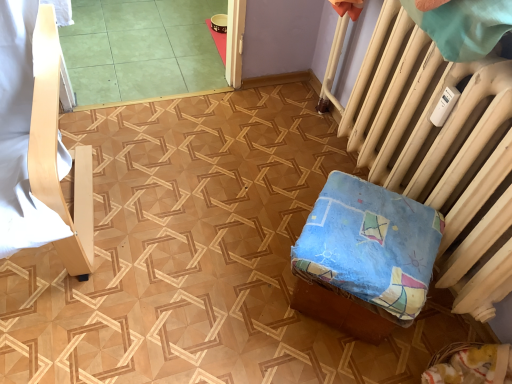
At what (x,y) coordinates should I click in order to perform the action: click on free area in between light wood chair at left, the first furniture viewed from the left, and blue fabric cushion at lower right, marked as the second furniture in a left-to-right arrangement. Please return your answer as a coordinate pair (x, y). Looking at the image, I should click on (188, 251).